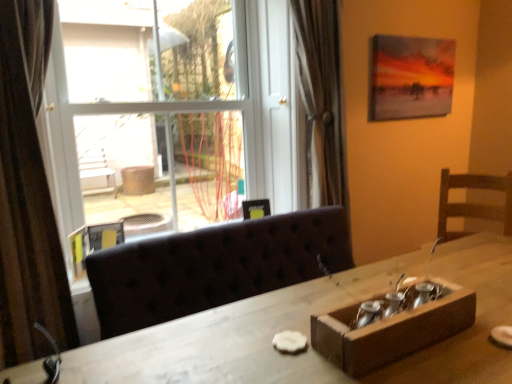
Question: From a real-world perspective, is transparent glass window at upper left positioned above or below matte canvas painting at upper right, the 2th picture frame ordered from the bottom?

Choices:
 (A) below
 (B) above

Answer: (A)

Question: Would you say transparent glass window at upper left is to the left or to the right of matte canvas painting at upper right, arranged as the first picture frame when viewed from the right, in the picture?

Choices:
 (A) left
 (B) right

Answer: (A)

Question: Which of these objects is positioned closest to the transparent glass window at upper left?

Choices:
 (A) wooden box at lower right
 (B) matte canvas painting at upper right, the 2th picture frame from the front
 (C) metallic silver picture frame at left, which is the first picture frame from left to right
 (D) wooden table at center
 (E) brown textured curtain at left

Answer: (E)

Question: Which is farther from the matte canvas painting at upper right, the first picture frame from the back?

Choices:
 (A) metallic silver picture frame at left, which is the 2th picture frame from right to left
 (B) wooden table at center
 (C) wooden box at lower right
 (D) brown textured curtain at left
 (E) transparent glass window at upper left

Answer: (A)